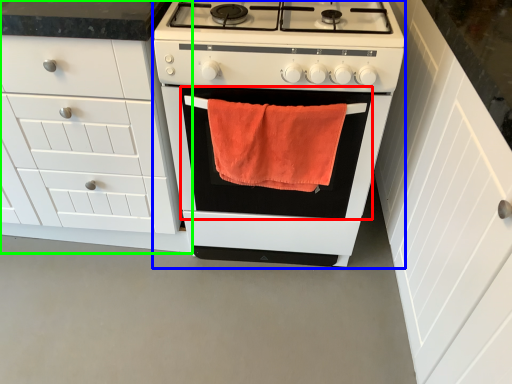
Question: Estimate the real-world distances between objects in this image. Which object is closer to oven (highlighted by a red box), appliance (highlighted by a blue box) or cabinetry (highlighted by a green box)?

Choices:
 (A) appliance
 (B) cabinetry

Answer: (A)